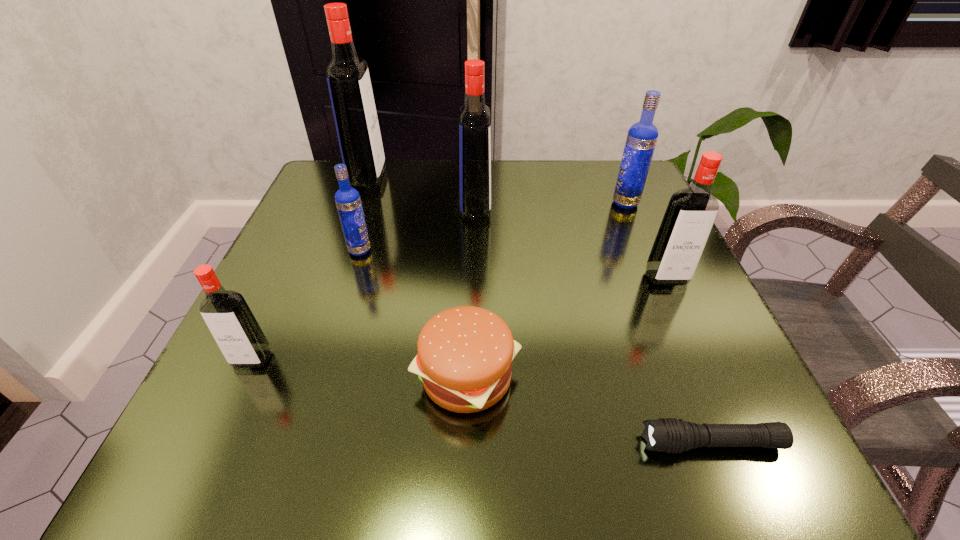
Locate an element on the screen. The image size is (960, 540). the leftmost object is located at coordinates pos(236,331).

Locate an element on the screen. The image size is (960, 540). the nearest red vodka is located at coordinates (236, 331).

Find the location of a particular element. Image resolution: width=960 pixels, height=540 pixels. hamburger is located at coordinates 465,354.

Image resolution: width=960 pixels, height=540 pixels. Identify the location of the shortest object. (671, 435).

Find the location of a particular element. flashlight is located at coordinates (671, 435).

The width and height of the screenshot is (960, 540). I want to click on blank area located 0.290m on the front and back of the farthest red vodka, so click(507, 178).

The width and height of the screenshot is (960, 540). Identify the location of vacant space situated 0.190m on the front and back of the second red vodka from right to left. (579, 208).

Locate an element on the screen. free space located 0.130m on the front of the bigger blue vodka is located at coordinates (645, 249).

This screenshot has height=540, width=960. Find the location of `vacant space located on the front and back of the fifth farthest vodka`. vacant space located on the front and back of the fifth farthest vodka is located at coordinates (750, 462).

This screenshot has width=960, height=540. I want to click on vacant area situated on the right of the fourth farthest vodka, so (469, 251).